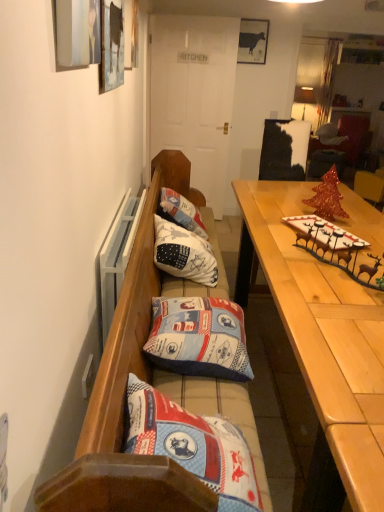
Question: Considering the relative sizes of light wood table at right and white cotton cushion at center, which is the 2th pillow in bottom-to-top order, in the image provided, is light wood table at right bigger than white cotton cushion at center, which is the 2th pillow in bottom-to-top order,?

Choices:
 (A) no
 (B) yes

Answer: (B)

Question: From a real-world perspective, is light wood table at right located beneath white cotton cushion at center, which appears as the 2th pillow when viewed from the front?

Choices:
 (A) yes
 (B) no

Answer: (A)

Question: Is light wood table at right facing towards white cotton cushion at center, which appears as the 2th pillow when viewed from the front?

Choices:
 (A) yes
 (B) no

Answer: (B)

Question: Is light wood table at right closer to camera compared to white cotton cushion at center, the first pillow from the back?

Choices:
 (A) no
 (B) yes

Answer: (B)

Question: Is light wood table at right positioned with its back to white cotton cushion at center, which appears as the 2th pillow when viewed from the front?

Choices:
 (A) no
 (B) yes

Answer: (B)

Question: Do you think matte black cow at upper center is within blue fabric pillow at center, positioned as the 2th pillow in back-to-front order, or outside of it?

Choices:
 (A) outside
 (B) inside

Answer: (A)

Question: Considering their positions, is matte black cow at upper center located in front of or behind blue fabric pillow at center, the 1th pillow from the front?

Choices:
 (A) behind
 (B) front

Answer: (A)

Question: Is matte black cow at upper center wider or thinner than blue fabric pillow at center, which appears as the 1th pillow when ordered from the bottom?

Choices:
 (A) thin
 (B) wide

Answer: (A)

Question: From the image's perspective, is matte black cow at upper center positioned above or below blue fabric pillow at center, the 1th pillow from the front?

Choices:
 (A) above
 (B) below

Answer: (A)

Question: Considering the positions of point (379, 458) and point (167, 264), is point (379, 458) closer or farther from the camera than point (167, 264)?

Choices:
 (A) farther
 (B) closer

Answer: (B)

Question: Visually, is light wood table at right positioned to the left or to the right of white cotton cushion at center, which is the first pillow in top-to-bottom order?

Choices:
 (A) left
 (B) right

Answer: (B)

Question: Considering the positions of light wood table at right and white cotton cushion at center, the first pillow from the back, in the image, is light wood table at right bigger or smaller than white cotton cushion at center, the first pillow from the back,?

Choices:
 (A) big
 (B) small

Answer: (A)

Question: From the image's perspective, relative to white cotton cushion at center, the first pillow from the back, is light wood table at right above or below?

Choices:
 (A) above
 (B) below

Answer: (B)

Question: Is white cotton cushion at center, which appears as the 2th pillow when viewed from the front, wider or thinner than matte black cow at upper center?

Choices:
 (A) thin
 (B) wide

Answer: (B)

Question: Considering the positions of point (210, 271) and point (249, 30), is point (210, 271) closer or farther from the camera than point (249, 30)?

Choices:
 (A) farther
 (B) closer

Answer: (B)